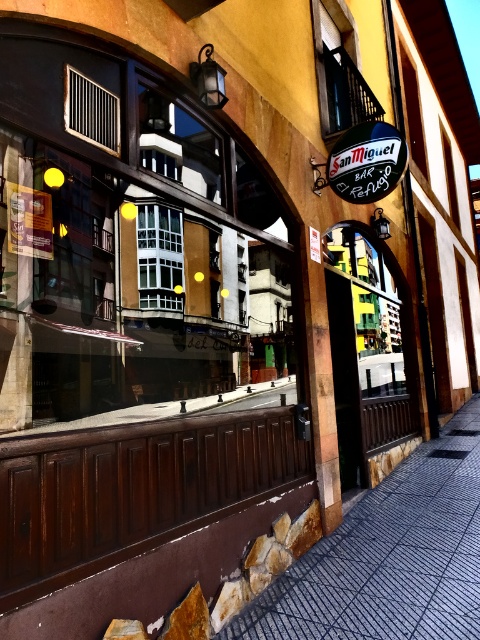
This screenshot has width=480, height=640. What do you see at coordinates (158, 257) in the screenshot? I see `white glass window at center` at bounding box center [158, 257].

Locate an element on the screen. The image size is (480, 640). white glass window at center is located at coordinates (158, 257).

Who is more distant from viewer, (143, 211) or (92, 100)?

The point (143, 211) is behind.

I want to click on white glass window at center, so click(x=158, y=257).

Which is behind, point (460, 493) or point (110, 113)?

The point (460, 493) is more distant.

Is dark gray textured pavement at lower center thinner than matte black vent at upper left?

Incorrect, dark gray textured pavement at lower center's width is not less than matte black vent at upper left's.

Between point (435, 472) and point (103, 122), which one is positioned behind?

Positioned behind is point (435, 472).

Where is `dark gray textured pavement at lower center`? dark gray textured pavement at lower center is located at coordinates (389, 556).

Consider the image. Can you confirm if black matte sign at upper center is positioned to the left of white glass window at center?

In fact, black matte sign at upper center is to the right of white glass window at center.

Between point (337, 161) and point (144, 289), which one is positioned behind?

The point (337, 161) is more distant.

Locate an element on the screen. black matte sign at upper center is located at coordinates (367, 161).

Where is `black matte sign at upper center`? black matte sign at upper center is located at coordinates (367, 161).